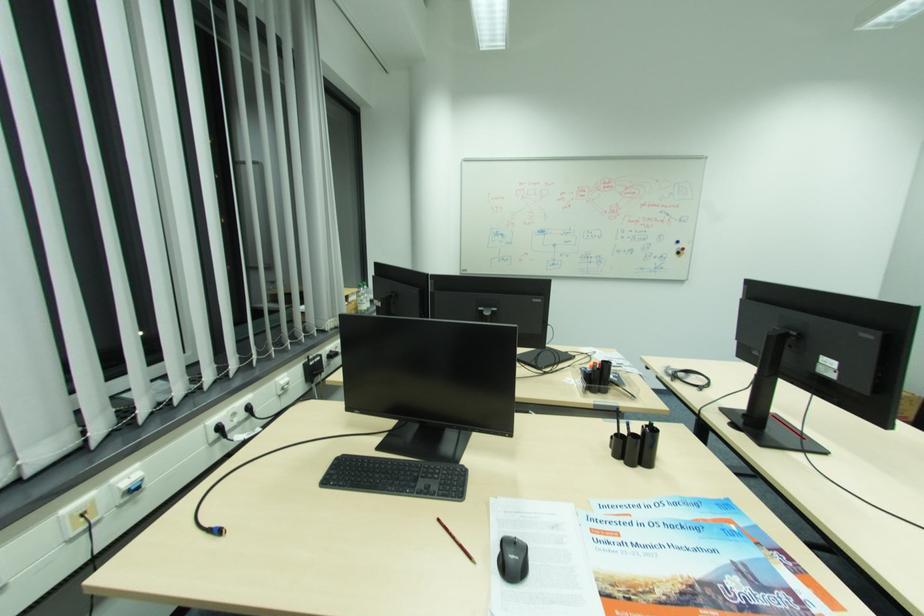
The location [456,540] corresponds to which object?

This point indicates the red and black pencil.